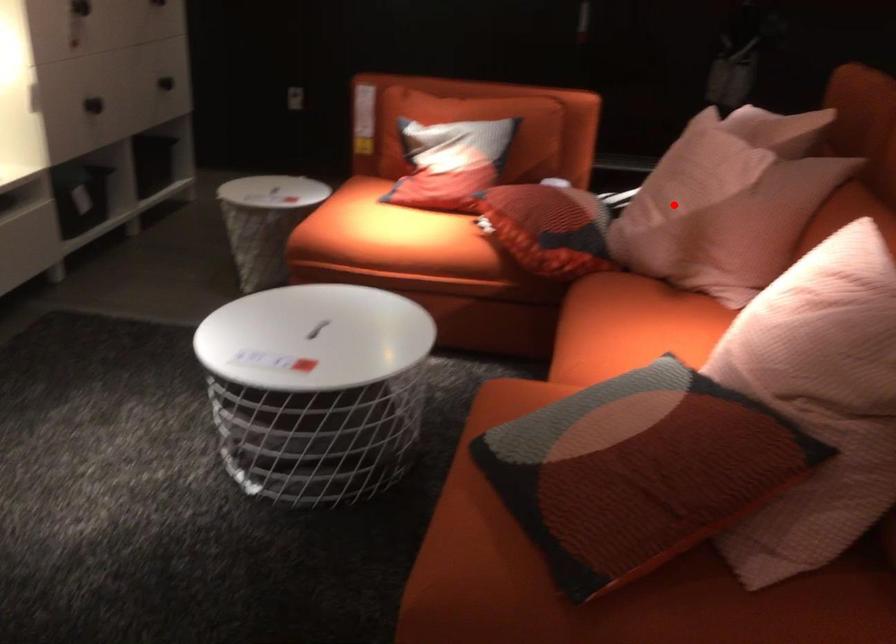
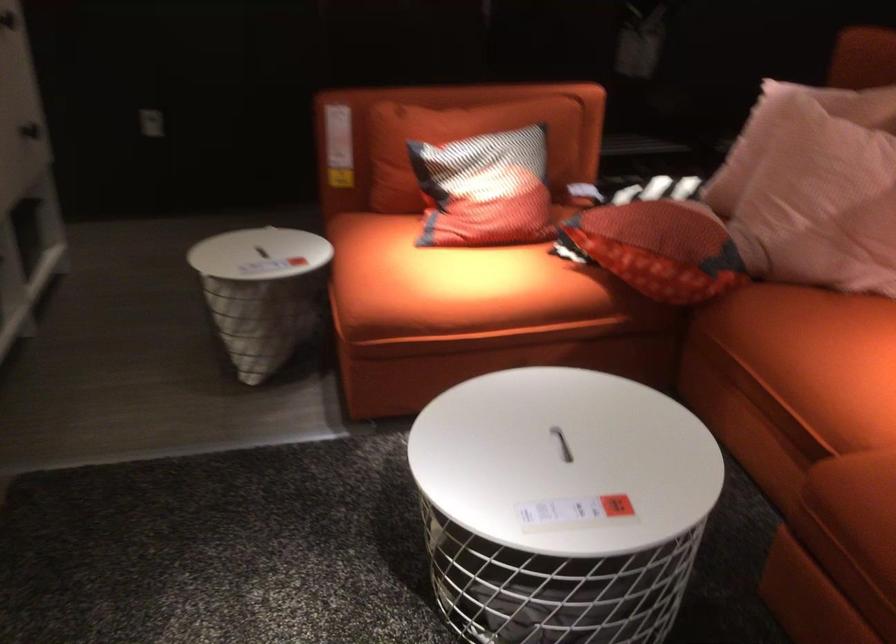
Question: I am providing you with two images of the same scene from different viewpoints. Given a red point in image1, look at the same physical point in image2. Is it:

Choices:
 (A) Closer to the viewpoint
 (B) Farther from the viewpoint

Answer: (A)